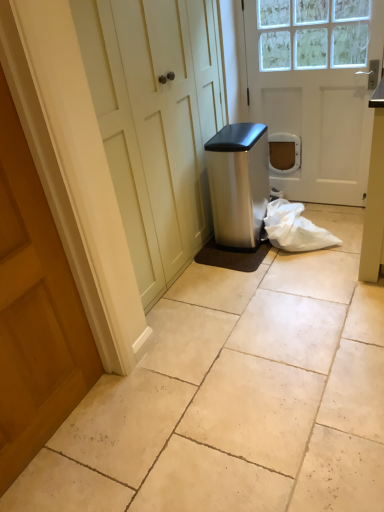
Describe the element at coordinates (294, 228) in the screenshot. This screenshot has height=512, width=384. I see `white plastic bag at lower right` at that location.

In order to face white matte door at center, which appears as the first door when viewed from the top, should I rotate leftwards or rightwards?

Rotate right and turn 14.220 degrees.

Where is `beige tile floor at center`? beige tile floor at center is located at coordinates (236, 397).

Would you say beige tile floor at center is a long distance from white plastic bag at lower right?

They are positioned close to each other.

From a real-world perspective, is beige tile floor at center on top of white plastic bag at lower right?

No, from a real-world perspective, beige tile floor at center is not over white plastic bag at lower right

In the scene shown: Is beige tile floor at center spatially inside white plastic bag at lower right, or outside of it?

The correct answer is: outside.

Is beige tile floor at center to the right of white plastic bag at lower right from the viewer's perspective?

In fact, beige tile floor at center is to the left of white plastic bag at lower right.

In the image, is wooden door at left, the second door in the top-to-bottom sequence, on the left side or the right side of satin silver trash can at center?

From the image, it's evident that wooden door at left, the second door in the top-to-bottom sequence, is to the left of satin silver trash can at center.

Is wooden door at left, the second door in the right-to-left sequence, next to satin silver trash can at center and touching it?

wooden door at left, the second door in the right-to-left sequence, and satin silver trash can at center are clearly separated.

How far apart are wooden door at left, the 1th door from the bottom, and satin silver trash can at center?

A distance of 4.43 feet exists between wooden door at left, the 1th door from the bottom, and satin silver trash can at center.

From a real-world perspective, is wooden door at left, the second door in the top-to-bottom sequence, physically located above or below satin silver trash can at center?

wooden door at left, the second door in the top-to-bottom sequence, is above satin silver trash can at center.

Considering the relative positions of satin silver trash can at center and white matte door at center, which is counted as the 2th door, starting from the left, in the image provided, is satin silver trash can at center to the left or to the right of white matte door at center, which is counted as the 2th door, starting from the left,?

satin silver trash can at center is to the left of white matte door at center, which is counted as the 2th door, starting from the left.

How distant is satin silver trash can at center from white matte door at center, acting as the second door starting from the bottom?

satin silver trash can at center is 18.95 inches away from white matte door at center, acting as the second door starting from the bottom.

Are satin silver trash can at center and white matte door at center, the 1th door when ordered from back to front, located far from each other?

No.

Is beige tile floor at center shorter than satin silver trash can at center?

Yes.

Considering the positions of point (212, 355) and point (234, 148), is point (212, 355) closer or farther from the camera than point (234, 148)?

Clearly, point (212, 355) is closer to the camera than point (234, 148).

Can you tell me how much beige tile floor at center and satin silver trash can at center differ in facing direction?

They differ by 89.4 degrees in their facing directions.

Between beige tile floor at center and satin silver trash can at center, which one has smaller size?

satin silver trash can at center is smaller.

Which is more to the right, wooden door at left, the 1th door from the bottom, or white matte door at center, placed as the first door when sorted from right to left?

Positioned to the right is white matte door at center, placed as the first door when sorted from right to left.

From a real-world perspective, is wooden door at left, the 1th door from the bottom, on top of white matte door at center, which appears as the first door when viewed from the top?

Incorrect, from a real-world perspective, wooden door at left, the 1th door from the bottom, is lower than white matte door at center, which appears as the first door when viewed from the top.

From the image's perspective, between wooden door at left, the 1th door from the bottom, and white matte door at center, the 1th door when ordered from back to front, who is located below?

A: wooden door at left, the 1th door from the bottom, from the image's perspective.

Looking at the image, does wooden door at left, which is the second door in back-to-front order, seem bigger or smaller compared to white matte door at center, placed as the first door when sorted from right to left?

In the image, wooden door at left, which is the second door in back-to-front order, appears to be larger than white matte door at center, placed as the first door when sorted from right to left.

Which point is more forward, (253,168) or (72,371)?

The point (72,371) is in front.

From a real-world perspective, who is located lower, satin silver trash can at center or wooden door at left, the 1th door from the bottom?

satin silver trash can at center is physically lower.

Can you confirm if satin silver trash can at center is smaller than wooden door at left, positioned as the 1th door in front-to-back order?

Yes, satin silver trash can at center is smaller than wooden door at left, positioned as the 1th door in front-to-back order.

Between satin silver trash can at center and wooden door at left, arranged as the first door when viewed from the left, which one has more height?

wooden door at left, arranged as the first door when viewed from the left, is taller.

Locate an element on the screen. This screenshot has width=384, height=512. water cooler above the beige tile floor at center (from a real-world perspective) is located at coordinates (238, 183).

Who is smaller, satin silver trash can at center or beige tile floor at center?

satin silver trash can at center is smaller.

From a real-world perspective, is satin silver trash can at center physically below beige tile floor at center?

No, from a real-world perspective, satin silver trash can at center is not below beige tile floor at center.

Can you tell me how much satin silver trash can at center and beige tile floor at center differ in facing direction?

They differ by 89.4 degrees in their facing directions.

Where is `material behind the beige tile floor at center`? This screenshot has width=384, height=512. material behind the beige tile floor at center is located at coordinates (294, 228).

From a real-world perspective, count 1st doors upward from the satin silver trash can at center and point to it. Please provide its 2D coordinates.

[(34, 310)]

Based on their spatial positions, is satin silver trash can at center or wooden door at left, positioned as the 1th door in front-to-back order, closer to white plastic bag at lower right?

Among the two, satin silver trash can at center is located nearer to white plastic bag at lower right.

Looking at this image, from the image, which object appears to be farther from white matte door at center, acting as the second door starting from the bottom, beige tile floor at center or wooden door at left, the 1th door from the bottom?

Among the two, wooden door at left, the 1th door from the bottom, is located further to white matte door at center, acting as the second door starting from the bottom.

In the scene shown: Based on their spatial positions, is white matte door at center, which is counted as the 2th door, starting from the left, or white plastic bag at lower right further from beige tile floor at center?

Based on the image, white matte door at center, which is counted as the 2th door, starting from the left, appears to be further to beige tile floor at center.

When comparing their distances from wooden door at left, positioned as the 1th door in front-to-back order, does satin silver trash can at center or white matte door at center, which appears as the first door when viewed from the top, seem closer?

Based on the image, satin silver trash can at center appears to be nearer to wooden door at left, positioned as the 1th door in front-to-back order.

From the image, which object appears to be farther from white plastic bag at lower right, satin silver trash can at center or white matte door at center, which is counted as the 2th door, starting from the left?

Based on the image, white matte door at center, which is counted as the 2th door, starting from the left, appears to be further to white plastic bag at lower right.

Considering their positions, is white plastic bag at lower right positioned further to beige tile floor at center than wooden door at left, which is the second door in back-to-front order?

white plastic bag at lower right is positioned further to the anchor beige tile floor at center.

When comparing their distances from white plastic bag at lower right, does wooden door at left, the 1th door from the bottom, or satin silver trash can at center seem closer?

satin silver trash can at center.

From the image, which object appears to be farther from white matte door at center, placed as the first door when sorted from right to left, wooden door at left, positioned as the 1th door in front-to-back order, or satin silver trash can at center?

wooden door at left, positioned as the 1th door in front-to-back order, lies further to white matte door at center, placed as the first door when sorted from right to left, than the other object.

What are the coordinates of `water cooler between beige tile floor at center and white plastic bag at lower right in the front-back direction` in the screenshot? It's located at (238, 183).

This screenshot has height=512, width=384. In order to click on door positioned between beige tile floor at center and white plastic bag at lower right from near to far in this screenshot , I will do `click(316, 90)`.

Where is `concrete between wooden door at left, the second door in the right-to-left sequence, and white plastic bag at lower right from front to back`? The width and height of the screenshot is (384, 512). concrete between wooden door at left, the second door in the right-to-left sequence, and white plastic bag at lower right from front to back is located at coordinates (236, 397).

At what (x,y) coordinates should I click in order to perform the action: click on concrete between wooden door at left, the 1th door from the bottom, and white matte door at center, placed as the first door when sorted from right to left, in the front-back direction. Please return your answer as a coordinate pair (x, y). The image size is (384, 512). Looking at the image, I should click on (236, 397).